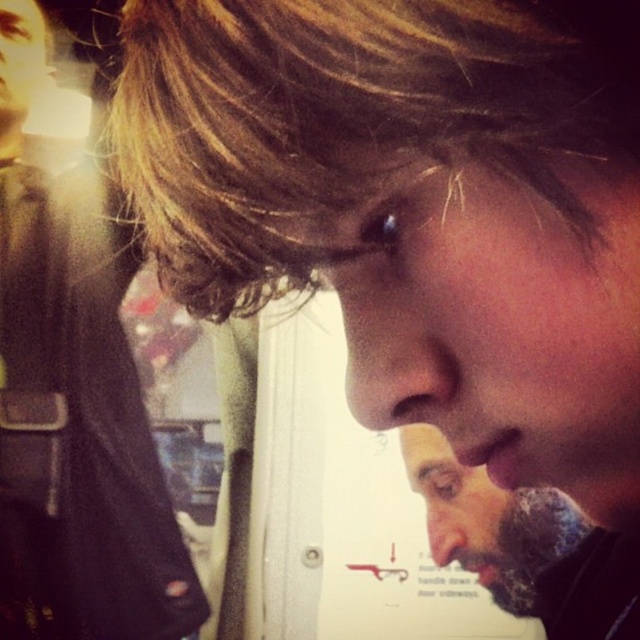
Question: From the image, what is the correct spatial relationship of gray textured beard at lower right in relation to smooth skin nose at center?

Choices:
 (A) below
 (B) above

Answer: (B)

Question: Is matte black jacket at left further to the viewer compared to smooth skin nose at center?

Choices:
 (A) yes
 (B) no

Answer: (B)

Question: Is matte skin nose at center to the right of smooth skin nose at center from the viewer's perspective?

Choices:
 (A) yes
 (B) no

Answer: (B)

Question: Which point appears farthest from the camera in this image?

Choices:
 (A) (40, 17)
 (B) (372, 390)
 (C) (577, 44)
 (D) (458, 544)

Answer: (A)

Question: Which point is closer to the camera?

Choices:
 (A) blondehair at upper center
 (B) matte skin nose at center
 (C) matte black jacket at left
 (D) smooth skin nose at center

Answer: (A)

Question: Considering the real-world distances, which object is closest to the matte skin nose at center?

Choices:
 (A) gray textured beard at lower right
 (B) smooth skin nose at center
 (C) blondehair at upper center
 (D) matte black jacket at left

Answer: (C)